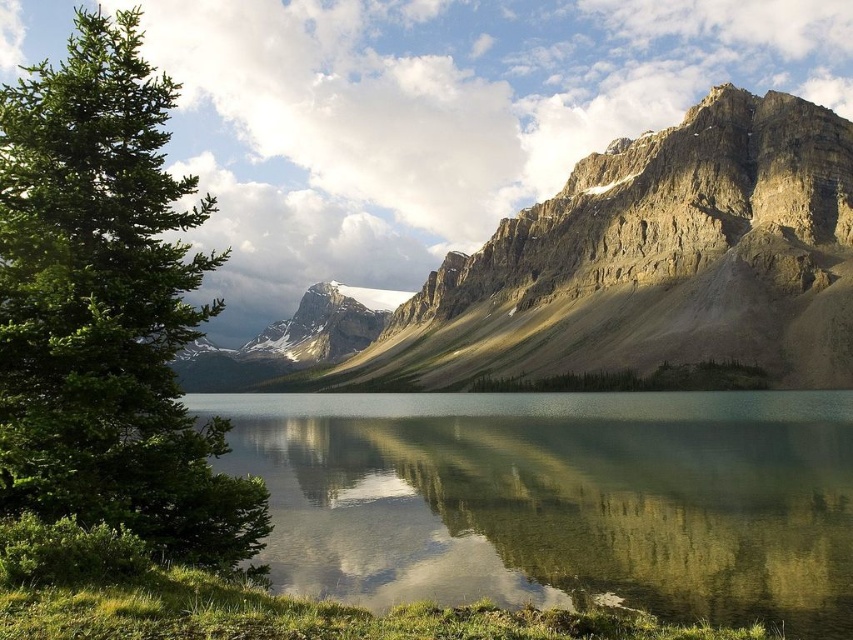
Question: Which point appears closest to the camera in this image?

Choices:
 (A) (51, 384)
 (B) (757, 596)

Answer: (A)

Question: Can you confirm if clear glass water at center is positioned below green leafy tree at left?

Choices:
 (A) yes
 (B) no

Answer: (A)

Question: Which object is closer to the camera taking this photo?

Choices:
 (A) green leafy tree at left
 (B) clear glass water at center

Answer: (A)

Question: Does clear glass water at center appear under green leafy tree at left?

Choices:
 (A) yes
 (B) no

Answer: (A)

Question: Which point appears farthest from the camera in this image?

Choices:
 (A) (120, 499)
 (B) (648, 408)

Answer: (B)

Question: In this image, where is clear glass water at center located relative to green leafy tree at left?

Choices:
 (A) right
 (B) left

Answer: (A)